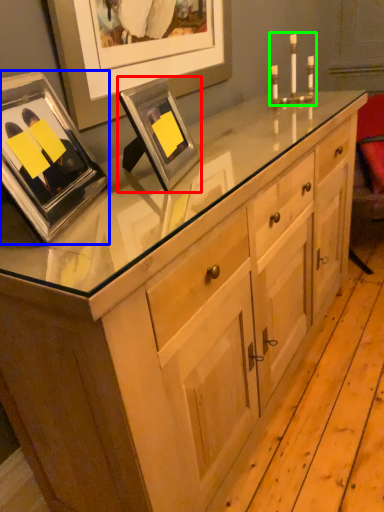
Question: Which object is positioned farthest from picture frame (highlighted by a red box)? Select from picture frame (highlighted by a blue box) and candle holder (highlighted by a green box).

Choices:
 (A) picture frame
 (B) candle holder

Answer: (B)